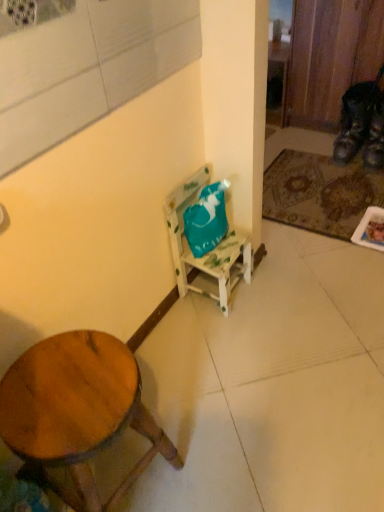
Where is `free spot above wooden stool at lower left (from a real-world perspective)`? Image resolution: width=384 pixels, height=512 pixels. free spot above wooden stool at lower left (from a real-world perspective) is located at coordinates (66, 390).